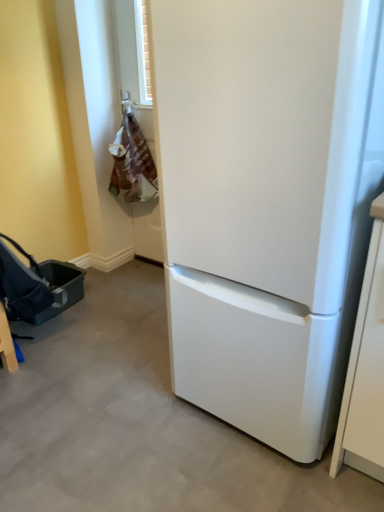
Where is `vacant position to the left of white matte refrigerator at center`? vacant position to the left of white matte refrigerator at center is located at coordinates point(125,398).